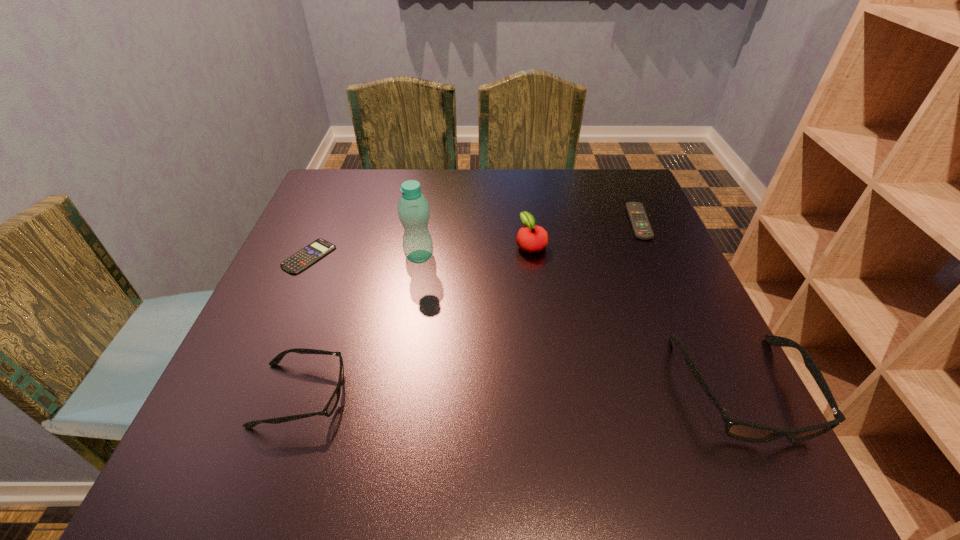
Image resolution: width=960 pixels, height=540 pixels. Identify the location of vacant position for inserting another spectacles evenly. (523, 392).